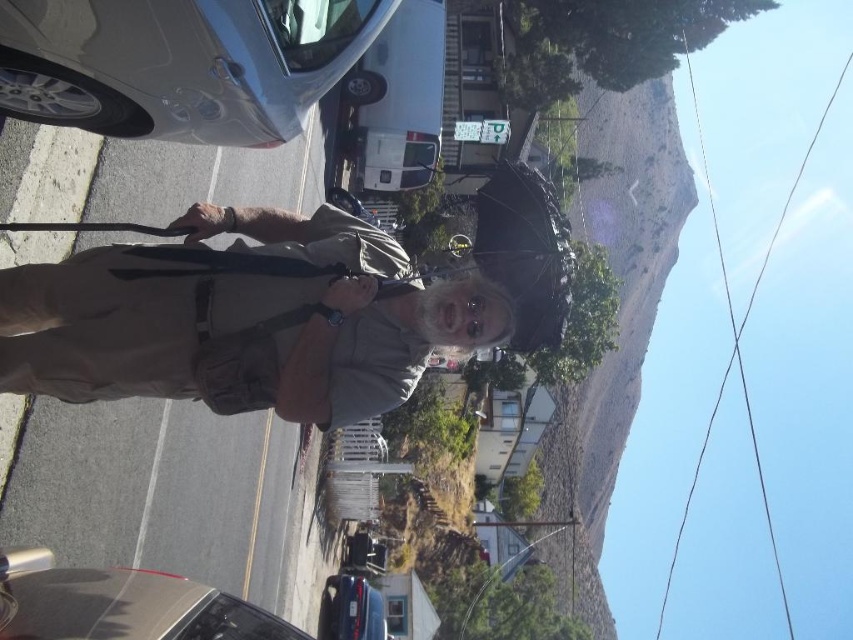
The image size is (853, 640). Describe the element at coordinates (178, 64) in the screenshot. I see `satin silver sedan at upper left` at that location.

Is point (154, 10) farther from viewer compared to point (263, 620)?

No.

The width and height of the screenshot is (853, 640). I want to click on satin silver sedan at upper left, so click(x=178, y=64).

Who is more forward, (125,593) or (563,276)?

Point (125,593) is more forward.

Looking at this image, who is positioned more to the left, shiny black car at lower left or black matte umbrella at center?

shiny black car at lower left is more to the left.

Who is more forward, (x=231, y=637) or (x=497, y=205)?

Point (x=231, y=637) is in front.

The image size is (853, 640). In order to click on shiny black car at lower left in this screenshot , I will do `click(128, 608)`.

Based on the photo, which is above, khaki fabric shirt at center or satin silver sedan at upper left?

satin silver sedan at upper left is above.

Does khaki fabric shirt at center have a smaller size compared to satin silver sedan at upper left?

Yes.

Identify the location of khaki fabric shirt at center. The width and height of the screenshot is (853, 640). (242, 323).

Identify the location of khaki fabric shirt at center. (242, 323).